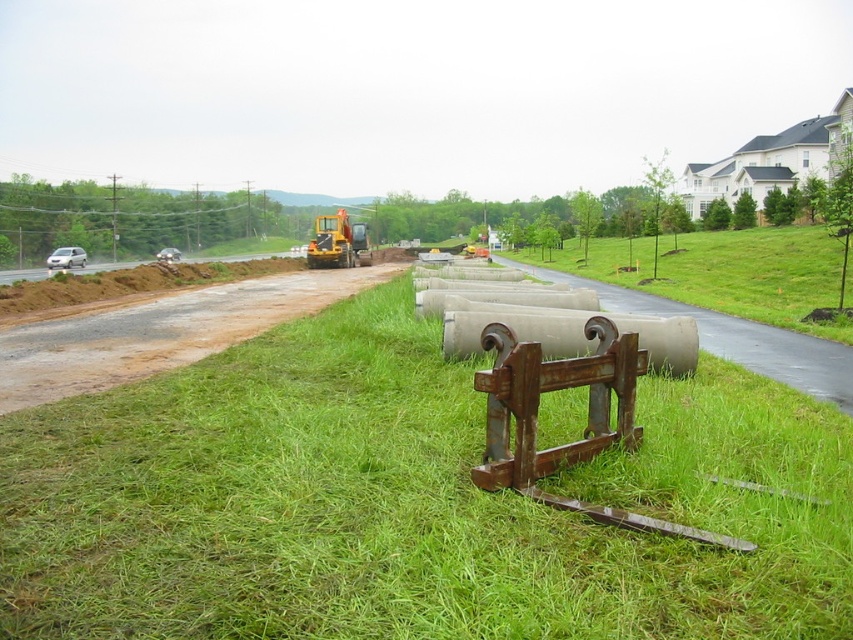
You are a delivery truck driver who needs to turn around your vehicle on the construction site. You see the brown dirt track at left and the yellow rubber excavator at center. Which location would allow you to safely make a U turn without hitting any obstacles?

The brown dirt track at left is wider than the yellow rubber excavator at center, so you should make the U turn on the brown dirt track at left to avoid obstacles.

You are a delivery driver who needs to navigate through this construction site. You see the green grass at center and the brown dirt track at left. Which path is closer to you as you approach the site?

The brown dirt track at left is behind green grass at center, so the green grass at center is closer to you as you approach the site.